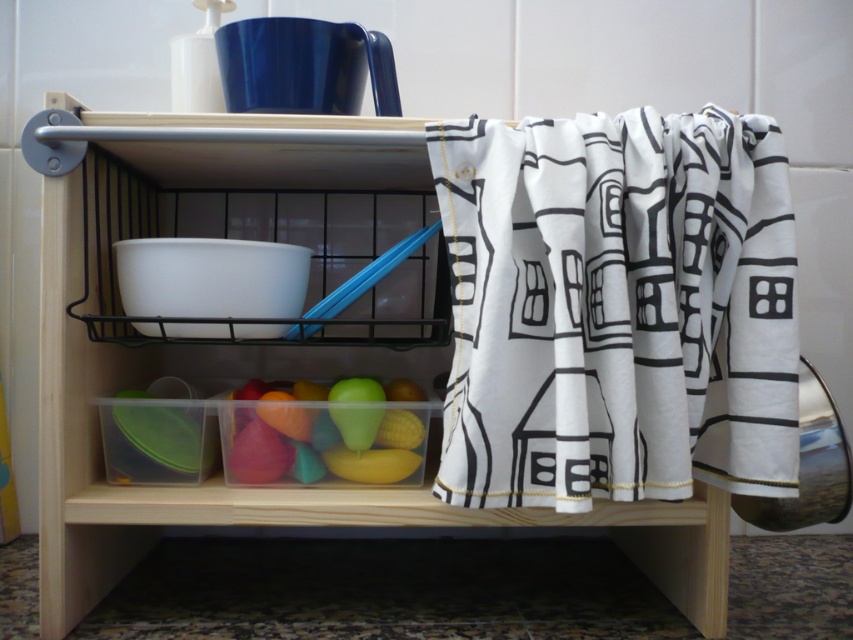
You are organizing the shelf and need to place a new item that requires 1 meter of vertical space. Given the white fabric at right and the transparent plastic container at lower center, which one is taller?

The transparent plastic container at lower center is taller than the white fabric at right, so it would require more vertical space.

You are organizing items on a shelf and need to place a new item between the white fabric at right and the transparent plastic container at lower center. Based on their positions, where should you place the new item?

The white fabric at right is to the right of the transparent plastic container at lower center, so you should place the new item between them by positioning it to the left of the white fabric at right and to the right of the transparent plastic container at lower center.

You are trying to place a 20 cm wide decorative item on the shelf. Can the white fabric at right and the transparent plastic container at lower center accommodate this item without moving anything else?

The white fabric at right is 17.43 centimeters away from the transparent plastic container at lower center. Since the decorative item is 20 cm wide, which is wider than the 17.43 cm space between them, it cannot fit without moving something else.